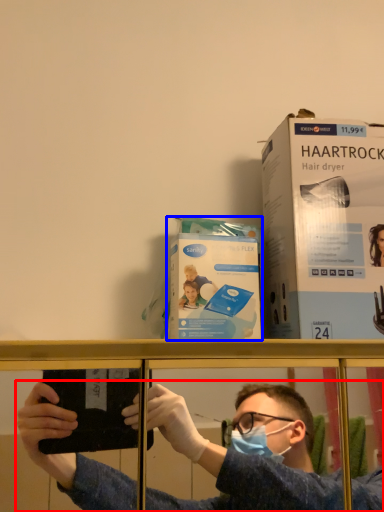
Question: Among these objects, which one is farthest to the camera, person (highlighted by a red box) or paperback book (highlighted by a blue box)?

Choices:
 (A) person
 (B) paperback book

Answer: (B)